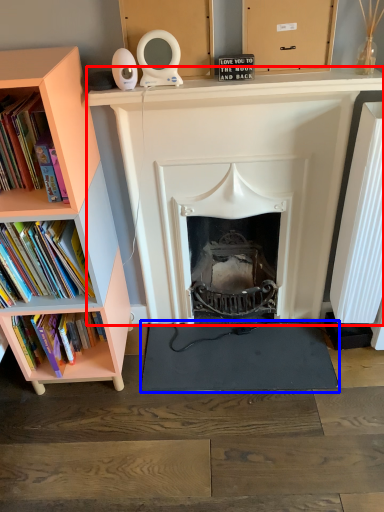
Question: Among these objects, which one is farthest to the camera, fireplace (highlighted by a red box) or yoga mat (highlighted by a blue box)?

Choices:
 (A) fireplace
 (B) yoga mat

Answer: (B)